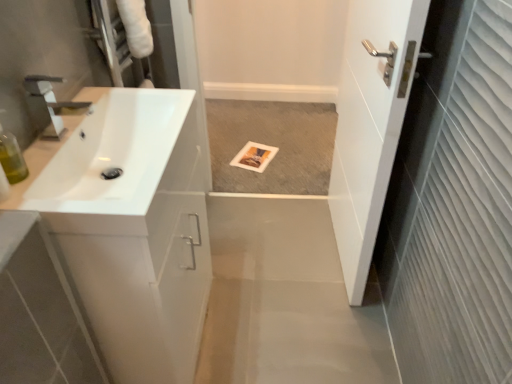
Question: Does white glossy door at right contain white glossy sink at left?

Choices:
 (A) no
 (B) yes

Answer: (A)

Question: Would you consider white glossy door at right to be distant from white glossy sink at left?

Choices:
 (A) no
 (B) yes

Answer: (A)

Question: Is the position of white glossy door at right more distant than that of white glossy sink at left?

Choices:
 (A) yes
 (B) no

Answer: (A)

Question: Does white glossy door at right have a lesser width compared to white glossy sink at left?

Choices:
 (A) yes
 (B) no

Answer: (A)

Question: From the image's perspective, is white glossy door at right on top of white glossy sink at left?

Choices:
 (A) no
 (B) yes

Answer: (B)

Question: Is white glossy door at right oriented towards white glossy sink at left?

Choices:
 (A) yes
 (B) no

Answer: (A)

Question: From a real-world perspective, is white glossy sink at left over white glossy sink at left?

Choices:
 (A) yes
 (B) no

Answer: (A)

Question: Is white glossy sink at left surrounding white glossy sink at left?

Choices:
 (A) no
 (B) yes

Answer: (A)

Question: Is white glossy sink at left to the right of white glossy sink at left from the viewer's perspective?

Choices:
 (A) yes
 (B) no

Answer: (B)

Question: Does white glossy sink at left have a smaller size compared to white glossy sink at left?

Choices:
 (A) no
 (B) yes

Answer: (B)

Question: From the image's perspective, would you say white glossy sink at left is positioned over white glossy sink at left?

Choices:
 (A) yes
 (B) no

Answer: (A)

Question: Can you confirm if white glossy sink at left is taller than white glossy sink at left?

Choices:
 (A) no
 (B) yes

Answer: (A)

Question: Can you confirm if white glossy sink at left is positioned to the right of translucent green bottle at left?

Choices:
 (A) no
 (B) yes

Answer: (B)